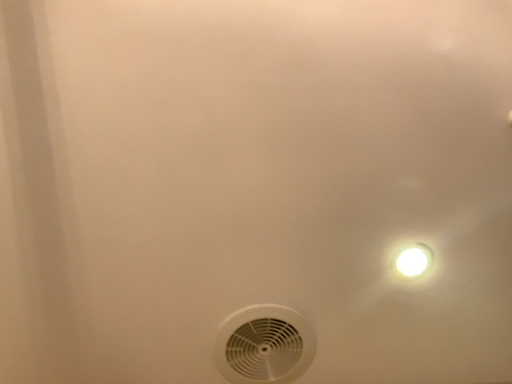
Question: Relative to white glossy light fixture at upper right, is white plastic mechanical fan at lower center in front or behind?

Choices:
 (A) behind
 (B) front

Answer: (A)

Question: In the image, is white plastic mechanical fan at lower center on the left side or the right side of white glossy light fixture at upper right?

Choices:
 (A) right
 (B) left

Answer: (B)

Question: Considering the positions of point (233, 379) and point (431, 251), is point (233, 379) closer or farther from the camera than point (431, 251)?

Choices:
 (A) farther
 (B) closer

Answer: (A)

Question: Is white glossy light fixture at upper right bigger or smaller than white plastic mechanical fan at lower center?

Choices:
 (A) small
 (B) big

Answer: (A)

Question: Would you say white glossy light fixture at upper right is to the left or to the right of white plastic mechanical fan at lower center in the picture?

Choices:
 (A) right
 (B) left

Answer: (A)

Question: In terms of width, does white glossy light fixture at upper right look wider or thinner when compared to white plastic mechanical fan at lower center?

Choices:
 (A) thin
 (B) wide

Answer: (A)

Question: From their relative heights in the image, would you say white glossy light fixture at upper right is taller or shorter than white plastic mechanical fan at lower center?

Choices:
 (A) short
 (B) tall

Answer: (B)